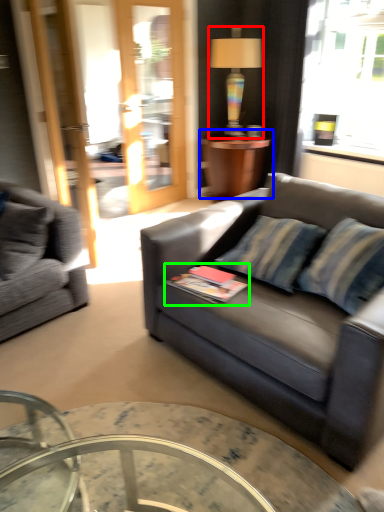
Question: Which object is positioned closest to lamp (highlighted by a red box)? Select from table (highlighted by a blue box) and book (highlighted by a green box).

Choices:
 (A) table
 (B) book

Answer: (A)